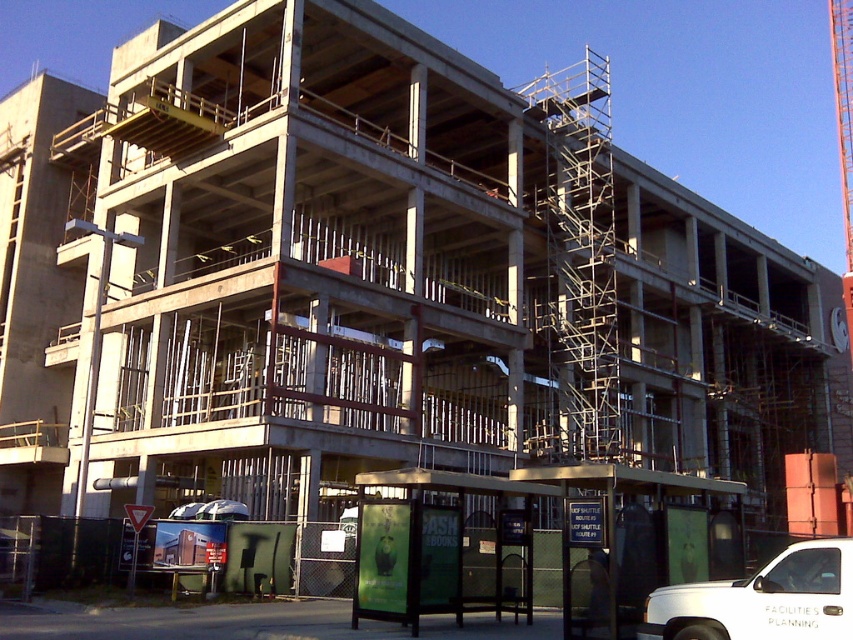
Question: Which point appears farthest from the camera in this image?

Choices:
 (A) (849, 122)
 (B) (804, 612)

Answer: (A)

Question: Is white matte truck at lower right smaller than orange metallic crane at upper right?

Choices:
 (A) yes
 (B) no

Answer: (A)

Question: Can you confirm if white matte truck at lower right is positioned to the right of orange metallic crane at upper right?

Choices:
 (A) yes
 (B) no

Answer: (B)

Question: Which object is closer to the camera taking this photo?

Choices:
 (A) orange metallic crane at upper right
 (B) white matte truck at lower right

Answer: (B)

Question: Does white matte truck at lower right have a smaller size compared to orange metallic crane at upper right?

Choices:
 (A) no
 (B) yes

Answer: (B)

Question: Which object appears farthest from the camera in this image?

Choices:
 (A) orange metallic crane at upper right
 (B) white matte truck at lower right

Answer: (A)